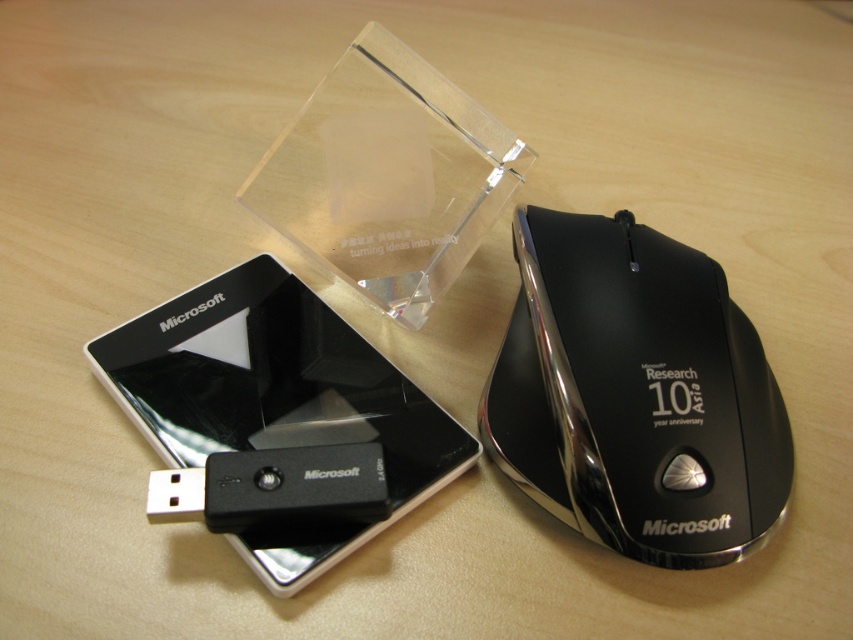
You are organizing items on a desk and need to place a new item between the black glossy mouse at right and the black glossy smartphone at upper left. What is the minimum distance you should maintain between them to ensure the new item fits?

The minimum distance you should maintain between the black glossy mouse at right and the black glossy smartphone at upper left is 11.38 inches to ensure the new item fits.

You are organizing items on a desk and need to place a new item between the black glossy mouse at right and the black glossy smartphone at upper left. Based on their positions, where should you place the new item?

The black glossy mouse at right is above the black glossy smartphone at upper left, so you should place the new item between them in the space below the mouse and above the smartphone.